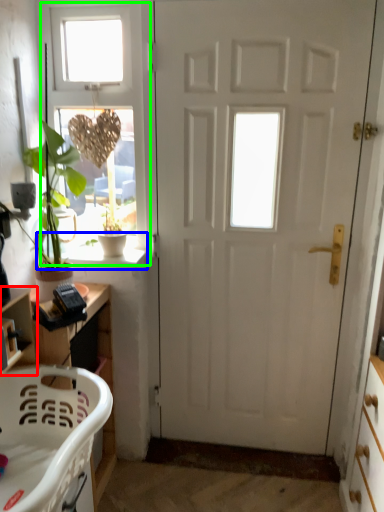
Question: Estimate the real-world distances between objects in this image. Which object is farther from shelf (highlighted by a red box), window sill (highlighted by a blue box) or window (highlighted by a green box)?

Choices:
 (A) window sill
 (B) window

Answer: (B)